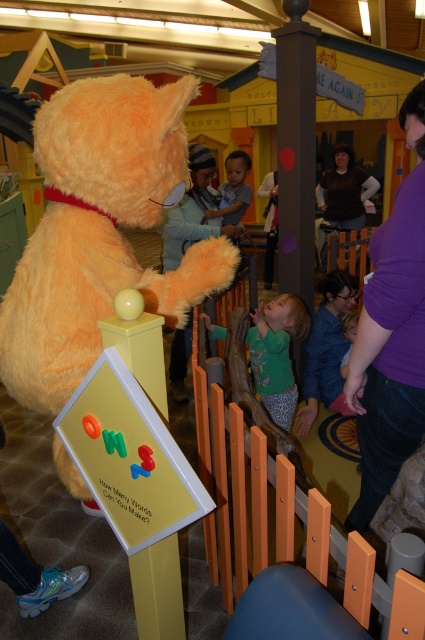
Consider the image. You are a photographer trying to capture a candid shot of the child in the scene. You need to ensure that both the green jersey at center and the blue denim jeans at lower right are in focus. Given that your camera has a depth of field that can cover 16 inches, will you be able to achieve this?

The green jersey at center is 16.37 inches from the blue denim jeans at lower right. Since the distance between them is slightly more than the camera can handle, you might need to adjust your focus or move closer to ensure both are in focus.